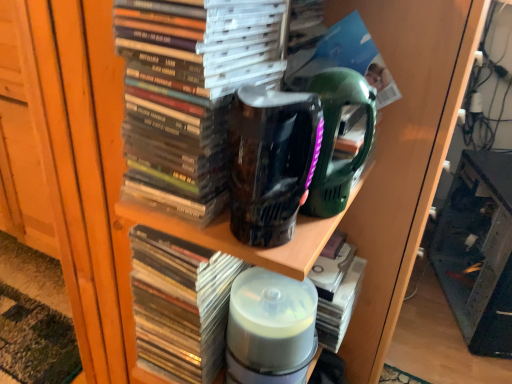
Where is `translucent plastic books at center, which is counted as the second book, starting from the top`? translucent plastic books at center, which is counted as the second book, starting from the top is located at coordinates (180, 304).

From the picture: Measure the distance between point (190, 82) and camera.

They are 17.01 inches apart.

Where is `translucent plastic container at center`? Image resolution: width=512 pixels, height=384 pixels. translucent plastic container at center is located at coordinates (270, 328).

Describe the element at coordinates (270, 328) in the screenshot. I see `translucent plastic container at center` at that location.

This screenshot has height=384, width=512. What do you see at coordinates (478, 251) in the screenshot?
I see `transparent glass tank at lower right` at bounding box center [478, 251].

Measure the distance between point (462, 162) and camera.

1.44 meters.

This screenshot has width=512, height=384. I want to click on translucent plastic books at center, which is counted as the second book, starting from the top, so click(x=180, y=304).

Considering the positions of points (245, 345) and (356, 282), is point (245, 345) farther from camera compared to point (356, 282)?

No.

Considering the relative sizes of translucent plastic container at center and transparent plastic cd case at center, acting as the third book starting from the top, in the image provided, is translucent plastic container at center wider than transparent plastic cd case at center, acting as the third book starting from the top,?

Incorrect, the width of translucent plastic container at center does not surpass that of transparent plastic cd case at center, acting as the third book starting from the top.

Locate an element on the screen. book behind the translucent plastic container at center is located at coordinates (336, 293).

Which is more to the right, transparent glass tank at lower right or transparent plastic cd case at center, the first book from the bottom?

Positioned to the right is transparent glass tank at lower right.

Is transparent glass tank at lower right touching transparent plastic cd case at center, acting as the third book starting from the top?

No, transparent glass tank at lower right is not beside transparent plastic cd case at center, acting as the third book starting from the top.

Is transparent plastic cd case at center, the first book from the bottom, inside transparent glass tank at lower right?

No, transparent glass tank at lower right does not contain transparent plastic cd case at center, the first book from the bottom.

Would you say transparent plastic cd case at center, the first book from the bottom, contains translucent plastic books at center, which is counted as the second book, starting from the top?

That's incorrect, translucent plastic books at center, which is counted as the second book, starting from the top, is not inside transparent plastic cd case at center, the first book from the bottom.

From a real-world perspective, who is located higher, transparent plastic cd case at center, the first book from the bottom, or translucent plastic books at center, which is counted as the second book, starting from the top?

translucent plastic books at center, which is counted as the second book, starting from the top, from a real-world perspective.

Consider the image. Which of these two, transparent plastic cd case at center, acting as the third book starting from the top, or translucent plastic books at center, which appears as the second book when ordered from the bottom, stands shorter?

transparent plastic cd case at center, acting as the third book starting from the top.

From a real-world perspective, is transparent plastic cd case at center, acting as the third book starting from the top, beneath matte black book at center, the first book from the top?

Yes.

Can you confirm if transparent plastic cd case at center, acting as the third book starting from the top, is shorter than matte black book at center, the first book from the top?

Correct, transparent plastic cd case at center, acting as the third book starting from the top, is not as tall as matte black book at center, the first book from the top.

Can you confirm if transparent plastic cd case at center, the first book from the bottom, is smaller than matte black book at center, arranged as the third book when ordered from the bottom?

Yes, transparent plastic cd case at center, the first book from the bottom, is smaller than matte black book at center, arranged as the third book when ordered from the bottom.

Is matte black book at center, arranged as the third book when ordered from the bottom, at the back of translucent plastic container at center?

translucent plastic container at center is not turned away from matte black book at center, arranged as the third book when ordered from the bottom.

Based on the photo, from the image's perspective, which one is positioned lower, translucent plastic container at center or matte black book at center, the first book from the top?

translucent plastic container at center is shown below in the image.

Is the surface of translucent plastic container at center in direct contact with matte black book at center, the first book from the top?

translucent plastic container at center and matte black book at center, the first book from the top, are clearly separated.

Is translucent plastic container at center closer to the viewer compared to matte black book at center, arranged as the third book when ordered from the bottom?

No, the depth of translucent plastic container at center is greater than that of matte black book at center, arranged as the third book when ordered from the bottom.

Is matte black book at center, arranged as the third book when ordered from the bottom, looking in the opposite direction of black glossy mug at center?

No, black glossy mug at center is not at the back of matte black book at center, arranged as the third book when ordered from the bottom.

From the image's perspective, between matte black book at center, arranged as the third book when ordered from the bottom, and black glossy mug at center, which one is located above?

matte black book at center, arranged as the third book when ordered from the bottom, is shown above in the image.

Considering the sizes of objects matte black book at center, the first book from the top, and black glossy mug at center in the image provided, who is shorter, matte black book at center, the first book from the top, or black glossy mug at center?

Standing shorter between the two is black glossy mug at center.

Is matte black book at center, arranged as the third book when ordered from the bottom, not inside black glossy mug at center?

matte black book at center, arranged as the third book when ordered from the bottom, lies outside black glossy mug at center's area.

Would you say transparent glass tank at lower right is outside translucent plastic books at center, which appears as the second book when ordered from the bottom?

transparent glass tank at lower right lies outside translucent plastic books at center, which appears as the second book when ordered from the bottom,'s area.

From the picture: In the image, is transparent glass tank at lower right positioned in front of or behind translucent plastic books at center, which is counted as the second book, starting from the top?

transparent glass tank at lower right is positioned farther from the viewer than translucent plastic books at center, which is counted as the second book, starting from the top.

From a real-world perspective, is transparent glass tank at lower right above or below translucent plastic books at center, which is counted as the second book, starting from the top?

Clearly, from a real-world perspective, transparent glass tank at lower right is below translucent plastic books at center, which is counted as the second book, starting from the top.

This screenshot has height=384, width=512. What are the coordinates of `bottle on the left of transparent plastic cd case at center, the first book from the bottom` in the screenshot? It's located at (270, 328).

Locate an element on the screen. This screenshot has width=512, height=384. the 1st book in front of the transparent glass tank at lower right, counting from the anchor's position is located at coordinates (336, 293).

Which object lies further to the anchor point translucent plastic container at center, matte black book at center, the first book from the top, or black glossy mug at center?

The object further to translucent plastic container at center is matte black book at center, the first book from the top.

Which object lies nearer to the anchor point transparent plastic cd case at center, acting as the third book starting from the top, translucent plastic container at center or black glossy mug at center?

Among the two, translucent plastic container at center is located nearer to transparent plastic cd case at center, acting as the third book starting from the top.

Based on their spatial positions, is black glossy mug at center or matte black book at center, the first book from the top, further from transparent glass tank at lower right?

The object further to transparent glass tank at lower right is matte black book at center, the first book from the top.

From the picture: From the image, which object appears to be farther from black glossy mug at center, translucent plastic container at center or translucent plastic books at center, which is counted as the second book, starting from the top?

translucent plastic container at center lies further to black glossy mug at center than the other object.

When comparing their distances from black glossy mug at center, does translucent plastic container at center or matte black book at center, arranged as the third book when ordered from the bottom, seem further?

The object further to black glossy mug at center is translucent plastic container at center.

Based on their spatial positions, is matte black book at center, arranged as the third book when ordered from the bottom, or translucent plastic container at center closer to translucent plastic books at center, which appears as the second book when ordered from the bottom?

translucent plastic container at center.

Estimate the real-world distances between objects in this image. Which object is further from translucent plastic container at center, black glossy mug at center or transparent glass tank at lower right?

transparent glass tank at lower right is further to translucent plastic container at center.

Looking at the image, which one is located closer to transparent plastic cd case at center, acting as the third book starting from the top, matte black book at center, arranged as the third book when ordered from the bottom, or black glossy mug at center?

black glossy mug at center is positioned closer to the anchor transparent plastic cd case at center, acting as the third book starting from the top.

Find the location of `bottle between black glossy mug at center and transparent plastic cd case at center, the first book from the bottom, in the front-back direction`. bottle between black glossy mug at center and transparent plastic cd case at center, the first book from the bottom, in the front-back direction is located at coordinates (270, 328).

Find the location of a particular element. The image size is (512, 384). book between black glossy mug at center and transparent glass tank at lower right in the horizontal direction is located at coordinates (336, 293).

The height and width of the screenshot is (384, 512). Find the location of `bottle between translucent plastic books at center, which is counted as the second book, starting from the top, and transparent glass tank at lower right`. bottle between translucent plastic books at center, which is counted as the second book, starting from the top, and transparent glass tank at lower right is located at coordinates (270, 328).

You are a GUI agent. You are given a task and a screenshot of the screen. Output one action in this format:
    pyautogui.click(x=<x>, y=<y>)
    Task: Click on the mug that lies between matte black book at center, arranged as the third book when ordered from the bottom, and translucent plastic books at center, which appears as the second book when ordered from the bottom, from top to bottom
    The image size is (512, 384).
    Given the screenshot: What is the action you would take?
    pyautogui.click(x=271, y=161)